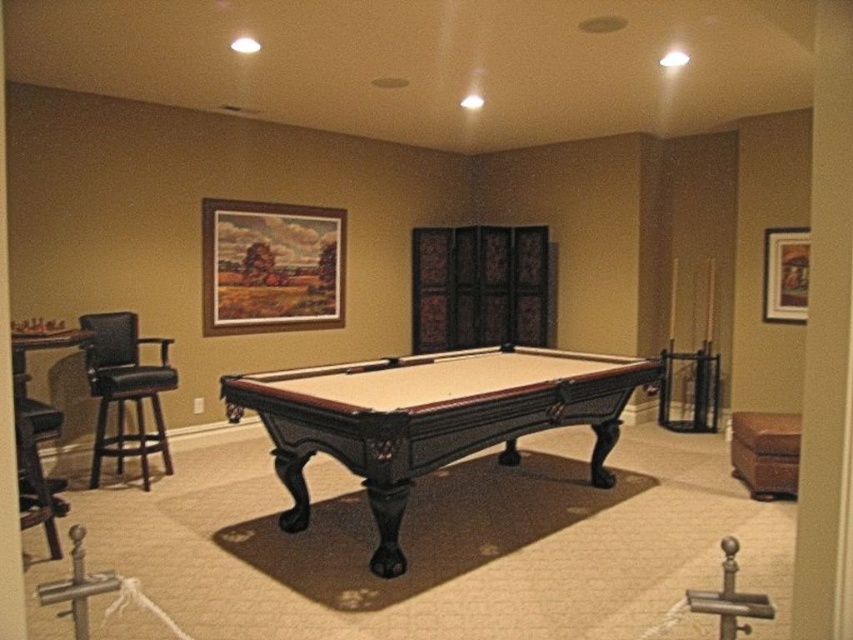
Based on the photo, you are standing at the point labeled point (782, 268) in the recreational room. You want to walk towards the pool table. Which direction should you move relative to the other point labeled point (759, 426)?

Since point (759, 426) is in front of point (782, 268), you should move towards the direction of point (759, 426) to reach the pool table.